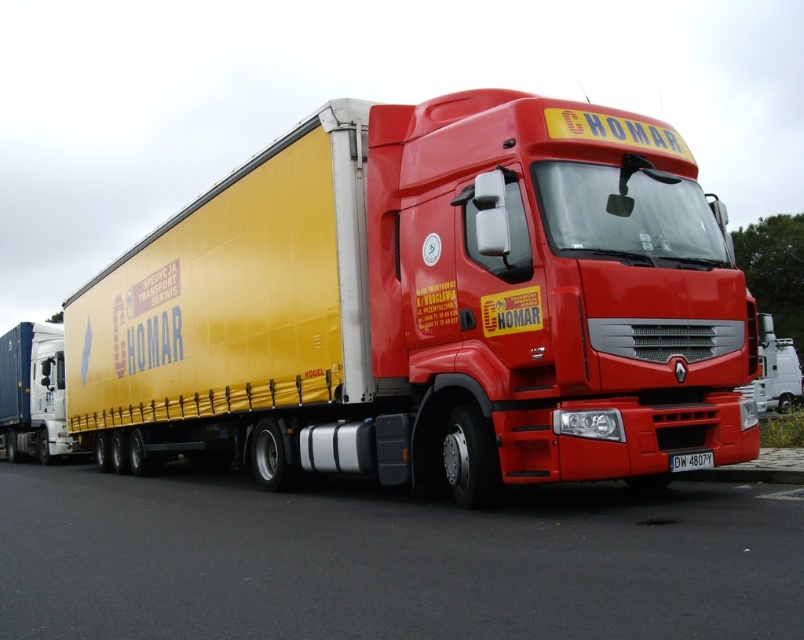
Question: Which object is the farthest from the black plastic license plate at lower center?

Choices:
 (A) metallic yellow trailer at center
 (B) black asphalt at lower center

Answer: (A)

Question: Does metallic yellow trailer at center have a greater width compared to metallic blue container at left?

Choices:
 (A) yes
 (B) no

Answer: (A)

Question: Among these points, which one is nearest to the camera?

Choices:
 (A) (673, 454)
 (B) (513, 188)
 (C) (15, 404)

Answer: (A)

Question: Which point is closer to the camera?

Choices:
 (A) metallic yellow trailer at center
 (B) black plastic license plate at lower center

Answer: (A)

Question: Can you confirm if black asphalt at lower center is thinner than metallic blue container at left?

Choices:
 (A) no
 (B) yes

Answer: (A)

Question: Does metallic yellow trailer at center appear on the left side of black asphalt at lower center?

Choices:
 (A) no
 (B) yes

Answer: (B)